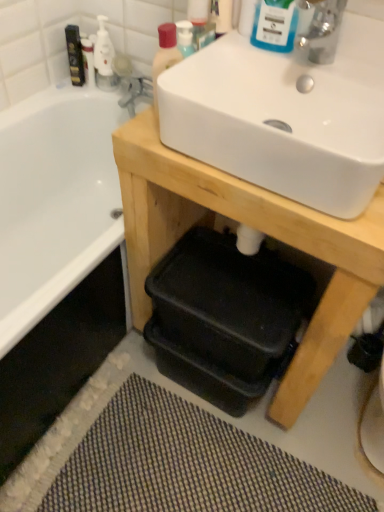
Where is `vacant region above textured gray bath mat at lower center (from a real-world perspective)`? This screenshot has width=384, height=512. vacant region above textured gray bath mat at lower center (from a real-world perspective) is located at coordinates point(194,461).